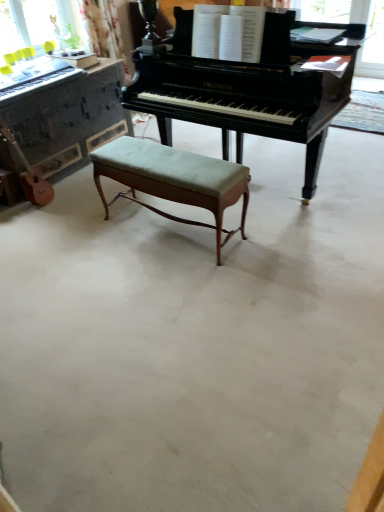
Identify the location of free space to the right of green fabric stool at center. Image resolution: width=384 pixels, height=512 pixels. (281, 236).